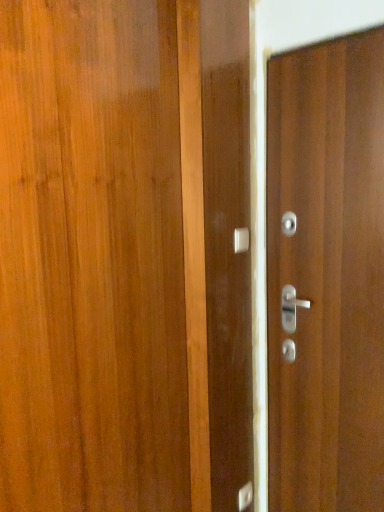
The width and height of the screenshot is (384, 512). What do you see at coordinates (245, 497) in the screenshot? I see `satin silver door handle at center, the second door handle viewed from the top` at bounding box center [245, 497].

Find the location of a particular element. The image size is (384, 512). wooden door at right is located at coordinates (326, 275).

Measure the distance between point (239, 245) and camera.

They are 1.60 meters apart.

This screenshot has height=512, width=384. I want to click on satin silver door handle at center, which is the second door handle from back to front, so click(x=241, y=240).

This screenshot has height=512, width=384. What are the coordinates of `satin silver door handle at center, the second door handle viewed from the top` in the screenshot? It's located at (245, 497).

From their relative heights in the image, would you say satin silver door handle at center, placed as the 2th door handle when sorted from front to back, is taller or shorter than satin silver door handle at center, the 1th door handle from the front?

Considering their sizes, satin silver door handle at center, placed as the 2th door handle when sorted from front to back, has more height than satin silver door handle at center, the 1th door handle from the front.

From the image's perspective, is satin silver door handle at center, acting as the 1th door handle starting from the bottom, located above satin silver door handle at center, the first door handle in the top-to-bottom sequence?

No, from the image's perspective, satin silver door handle at center, acting as the 1th door handle starting from the bottom, is not above satin silver door handle at center, the first door handle in the top-to-bottom sequence.

How much distance is there between satin silver door handle at center, which is the second door handle from back to front, and wooden door at right?

satin silver door handle at center, which is the second door handle from back to front, and wooden door at right are 19.98 inches apart.

Considering the points (238, 228) and (319, 494), which point is in front, point (238, 228) or point (319, 494)?

The point (238, 228) is closer to the camera.

Is satin silver door handle at center, which is the second door handle from back to front, next to wooden door at right?

No.

Does satin silver door handle at center, the first door handle in the top-to-bottom sequence, contain wooden door at right?

No, wooden door at right is not surrounded by satin silver door handle at center, the first door handle in the top-to-bottom sequence.

Considering the relative sizes of satin silver door handle at center, acting as the 1th door handle starting from the bottom, and wooden door at right in the image provided, is satin silver door handle at center, acting as the 1th door handle starting from the bottom, smaller than wooden door at right?

Yes, satin silver door handle at center, acting as the 1th door handle starting from the bottom, is smaller than wooden door at right.

Who is taller, satin silver door handle at center, the second door handle viewed from the top, or wooden door at right?

Standing taller between the two is wooden door at right.

Is satin silver door handle at center, acting as the 1th door handle starting from the bottom, far away from wooden door at right?

No, satin silver door handle at center, acting as the 1th door handle starting from the bottom, is in close proximity to wooden door at right.

In the image, there is a wooden door at right. What are the coordinates of `door handle below it (from a real-world perspective)` in the screenshot? It's located at (245, 497).

From the picture: From the image's perspective, which one is positioned lower, wooden door at right or satin silver door handle at center, acting as the 1th door handle starting from the bottom?

satin silver door handle at center, acting as the 1th door handle starting from the bottom, is shown below in the image.

Looking at their sizes, would you say wooden door at right is wider or thinner than satin silver door handle at center, the second door handle viewed from the top?

In the image, wooden door at right appears to be wider than satin silver door handle at center, the second door handle viewed from the top.

Considering the relative sizes of wooden door at right and satin silver door handle at center, acting as the 1th door handle starting from the bottom, in the image provided, is wooden door at right shorter than satin silver door handle at center, acting as the 1th door handle starting from the bottom,?

In fact, wooden door at right may be taller than satin silver door handle at center, acting as the 1th door handle starting from the bottom.

Is wooden door at right at the right side of satin silver door handle at center, the first door handle in the top-to-bottom sequence?

Yes.

The image size is (384, 512). In order to click on door handle above the wooden door at right (from the image's perspective) in this screenshot , I will do `click(241, 240)`.

Is wooden door at right bigger or smaller than satin silver door handle at center, the first door handle in the top-to-bottom sequence?

In the image, wooden door at right appears to be larger than satin silver door handle at center, the first door handle in the top-to-bottom sequence.

Does satin silver door handle at center, the 1th door handle from the front, come in front of satin silver door handle at center, placed as the first door handle when sorted from back to front?

Yes, it is.

From a real-world perspective, is satin silver door handle at center, the 1th door handle from the front, on top of satin silver door handle at center, placed as the 2th door handle when sorted from front to back?

Yes, from a real-world perspective, satin silver door handle at center, the 1th door handle from the front, is over satin silver door handle at center, placed as the 2th door handle when sorted from front to back

Consider the image. Between satin silver door handle at center, the first door handle in the top-to-bottom sequence, and satin silver door handle at center, placed as the 2th door handle when sorted from front to back, which one has more height?

satin silver door handle at center, placed as the 2th door handle when sorted from front to back.

Find the location of a particular element. The width and height of the screenshot is (384, 512). door handle above the satin silver door handle at center, acting as the 1th door handle starting from the bottom (from the image's perspective) is located at coordinates pos(241,240).

The width and height of the screenshot is (384, 512). I want to click on door on the right of satin silver door handle at center, the first door handle in the top-to-bottom sequence, so click(326, 275).

Based on their spatial positions, is satin silver door handle at center, acting as the 1th door handle starting from the bottom, or wooden door at right closer to satin silver door handle at center, the 2th door handle ordered from the bottom?

wooden door at right is positioned closer to the anchor satin silver door handle at center, the 2th door handle ordered from the bottom.

Based on the photo, estimate the real-world distances between objects in this image. Which object is further from wooden door at right, satin silver door handle at center, placed as the first door handle when sorted from back to front, or satin silver door handle at center, the 1th door handle from the front?

satin silver door handle at center, placed as the first door handle when sorted from back to front, is positioned further to the anchor wooden door at right.

Estimate the real-world distances between objects in this image. Which object is closer to satin silver door handle at center, acting as the 1th door handle starting from the bottom, satin silver door handle at center, which is the second door handle from back to front, or wooden door at right?

Among the two, wooden door at right is located nearer to satin silver door handle at center, acting as the 1th door handle starting from the bottom.

In the scene shown: Estimate the real-world distances between objects in this image. Which object is further from satin silver door handle at center, the 2th door handle ordered from the bottom, wooden door at right or satin silver door handle at center, the second door handle viewed from the top?

satin silver door handle at center, the second door handle viewed from the top, is positioned further to the anchor satin silver door handle at center, the 2th door handle ordered from the bottom.

When comparing their distances from satin silver door handle at center, acting as the 1th door handle starting from the bottom, does wooden door at right or satin silver door handle at center, which is the second door handle from back to front, seem further?

Based on the image, satin silver door handle at center, which is the second door handle from back to front, appears to be further to satin silver door handle at center, acting as the 1th door handle starting from the bottom.

From the image, which object appears to be farther from wooden door at right, satin silver door handle at center, the 1th door handle from the front, or satin silver door handle at center, placed as the first door handle when sorted from back to front?

Based on the image, satin silver door handle at center, placed as the first door handle when sorted from back to front, appears to be further to wooden door at right.

Locate an element on the screen. Image resolution: width=384 pixels, height=512 pixels. door between satin silver door handle at center, the 2th door handle ordered from the bottom, and satin silver door handle at center, acting as the 1th door handle starting from the bottom, in the vertical direction is located at coordinates (326, 275).